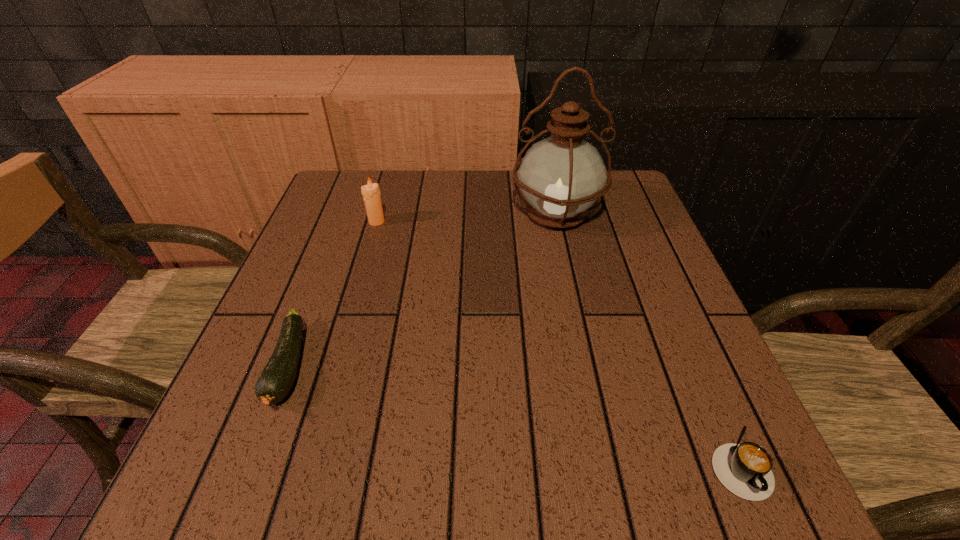
Where is `the third object from left to right`? The width and height of the screenshot is (960, 540). the third object from left to right is located at coordinates (561, 176).

You are a GUI agent. You are given a task and a screenshot of the screen. Output one action in this format:
    pyautogui.click(x=<x>, y=<y>)
    Task: Click on the oil lamp
    This screenshot has width=960, height=540.
    Given the screenshot: What is the action you would take?
    [561, 176]

The image size is (960, 540). Identify the location of the second object from left to right. (371, 193).

This screenshot has width=960, height=540. In order to click on candle in this screenshot , I will do `click(371, 193)`.

This screenshot has width=960, height=540. Identify the location of zucchini. (276, 379).

Where is `the third farthest object`? This screenshot has width=960, height=540. the third farthest object is located at coordinates (276, 379).

Locate an element on the screen. The height and width of the screenshot is (540, 960). the rightmost object is located at coordinates (744, 469).

Image resolution: width=960 pixels, height=540 pixels. Identify the location of cappuccino. (744, 469).

The image size is (960, 540). I want to click on vacant space situated 0.250m on the front of the third object from left to right, so click(x=581, y=327).

Identify the location of free space located on the back of the candle. The image size is (960, 540). (391, 171).